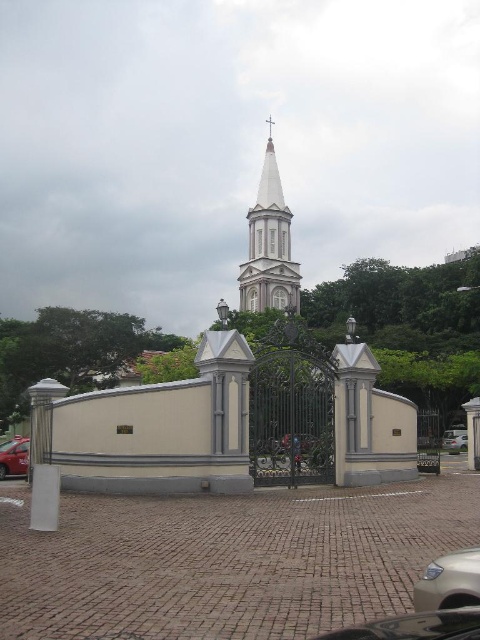
You are a delivery driver who needs to park your vehicle in the parking lot behind the church. The parking spaces are designed to accommodate vehicles up to the width of the metallic red taxi at lower left. Can the satin gold car at lower right fit into these spaces?

The satin gold car at lower right has a lesser width compared to the metallic red taxi at lower left. Since the parking spaces are designed for vehicles up to the width of the metallic red taxi at lower left, the satin gold car at lower right can fit into these spaces as it is narrower.